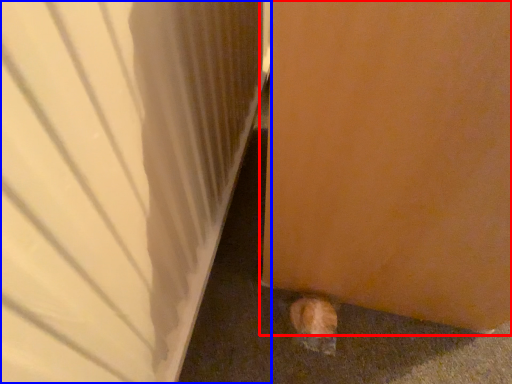
Question: Which object appears farthest to the camera in this image, door (highlighted by a red box) or door (highlighted by a blue box)?

Choices:
 (A) door
 (B) door

Answer: (A)